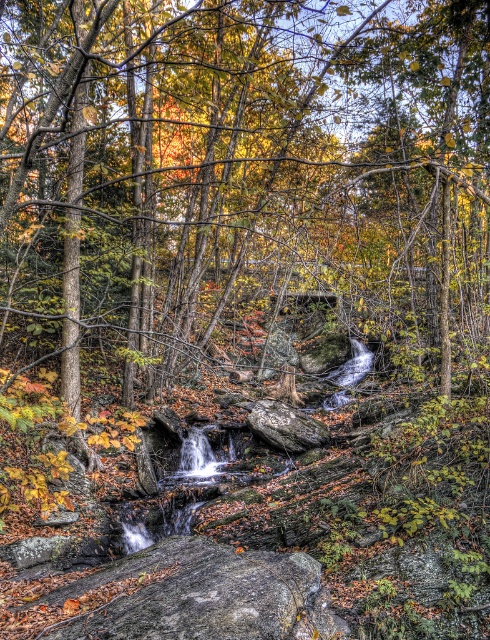
Question: Which point is farther from the camera taking this photo?

Choices:
 (A) (179, 566)
 (B) (282, 429)

Answer: (B)

Question: Can you confirm if gray rough boulder at lower center is positioned to the right of rough gray rock at center?

Choices:
 (A) yes
 (B) no

Answer: (B)

Question: Observing the image, what is the correct spatial positioning of gray rough boulder at lower center in reference to rough gray rock at center?

Choices:
 (A) left
 (B) right

Answer: (A)

Question: Among these points, which one is nearest to the camera?

Choices:
 (A) (103, 609)
 (B) (294, 410)

Answer: (A)

Question: Is gray rough boulder at lower center positioned before rough gray rock at center?

Choices:
 (A) yes
 (B) no

Answer: (A)